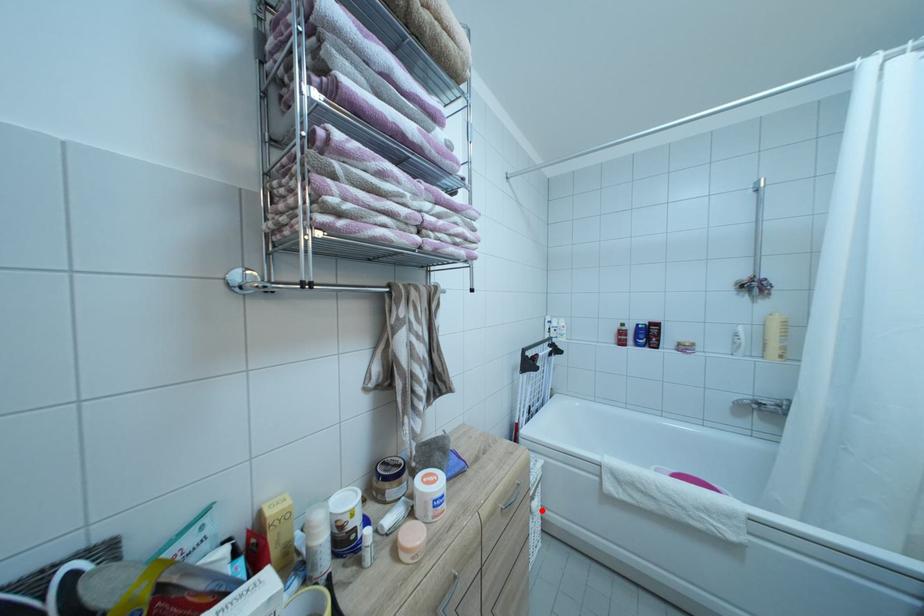
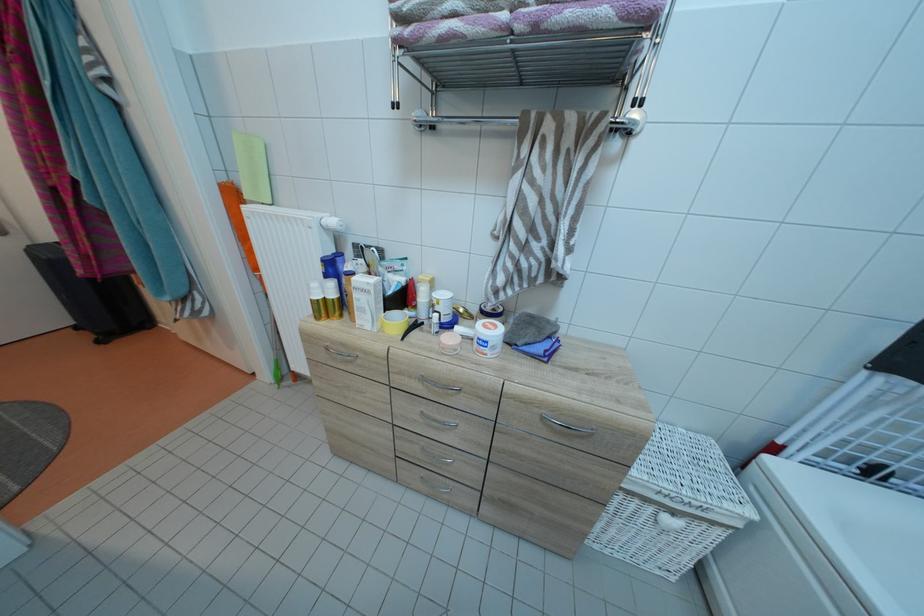
Question: I am providing you with two images of the same scene from different viewpoints. Given a red point in image1, look at the same physical point in image2. Is it:

Choices:
 (A) Closer to the viewpoint
 (B) Farther from the viewpoint

Answer: (A)